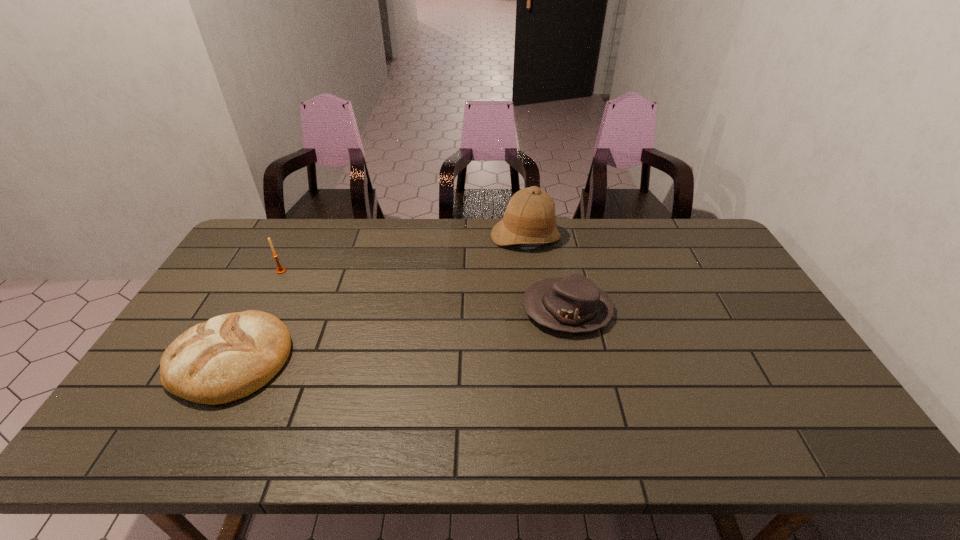
The height and width of the screenshot is (540, 960). In order to click on vacant area between the taller hat and the shorter hat in this screenshot , I will do `click(546, 273)`.

The height and width of the screenshot is (540, 960). Identify the location of unoccupied area between the farthest object and the nearer hat. (546, 273).

You are a GUI agent. You are given a task and a screenshot of the screen. Output one action in this format:
    pyautogui.click(x=<x>, y=<y>)
    Task: Click on the vacant space that's between the nearer hat and the candle_holder
    The width and height of the screenshot is (960, 540).
    Given the screenshot: What is the action you would take?
    pyautogui.click(x=424, y=291)

The width and height of the screenshot is (960, 540). In order to click on vacant area between the taller hat and the shorter hat in this screenshot , I will do `click(546, 273)`.

Where is `free space between the nearer hat and the third shortest object`? This screenshot has height=540, width=960. free space between the nearer hat and the third shortest object is located at coordinates (424, 291).

Identify the location of vacant space in between the farthest object and the second tallest object. (403, 254).

I want to click on vacant area that lies between the bread and the nearer hat, so click(398, 335).

The width and height of the screenshot is (960, 540). I want to click on vacant point located between the farthest object and the candle_holder, so click(x=403, y=254).

The height and width of the screenshot is (540, 960). I want to click on empty location between the nearer hat and the candle_holder, so click(424, 291).

Where is `object that is the nearest to the second farthest object`? The image size is (960, 540). object that is the nearest to the second farthest object is located at coordinates (230, 356).